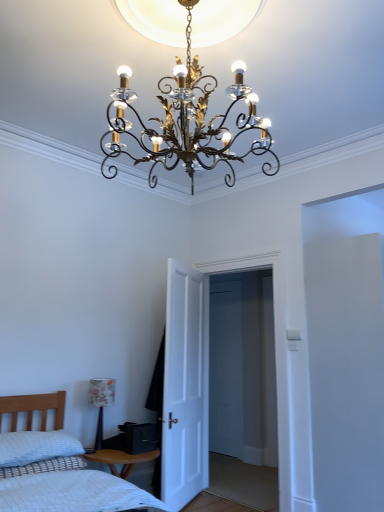
Question: From the image's perspective, relative to white matte door at center, is gold metallic chandelier at center, which is counted as the 2th lamp, starting from the back, above or below?

Choices:
 (A) above
 (B) below

Answer: (A)

Question: Based on their positions, is gold metallic chandelier at center, marked as the second lamp in a bottom-to-top arrangement, located to the left or right of white matte door at center?

Choices:
 (A) left
 (B) right

Answer: (B)

Question: Estimate the real-world distances between objects in this image. Which object is farther from the gold metallic chandelier at center, marked as the second lamp in a left-to-right arrangement?

Choices:
 (A) white quilted bed at lower left
 (B) floral-patterned fabric lampshade at lower left, positioned as the 1th lamp in bottom-to-top order
 (C) white matte door at center
 (D) white textured pillow at lower left

Answer: (B)

Question: Estimate the real-world distances between objects in this image. Which object is closer to the white quilted bed at lower left?

Choices:
 (A) gold metallic chandelier at center, which is counted as the 2th lamp, starting from the back
 (B) white matte door at center
 (C) white textured pillow at lower left
 (D) floral-patterned fabric lampshade at lower left, which is the 2th lamp in front-to-back order

Answer: (C)